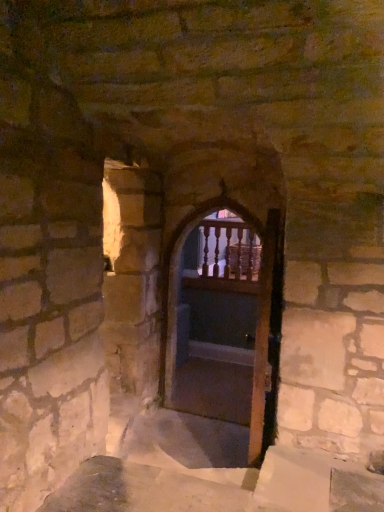
This screenshot has width=384, height=512. Identify the location of wooden screen door at center. (267, 339).

From a real-world perspective, is wooden screen door at center positioned over wooden at center based on gravity?

No, from a real-world perspective, wooden screen door at center is not above wooden at center.

Which of these two, wooden screen door at center or wooden at center, is wider?

wooden at center is wider.

Is wooden screen door at center shorter than wooden at center?

Yes.

Does point (269, 212) lie in front of point (203, 360)?

Yes, it is in front of point (203, 360).

From a real-world perspective, is wooden screen door at center under wooden balusters at center?

Yes, from a real-world perspective, wooden screen door at center is beneath wooden balusters at center.

Is wooden screen door at center far away from wooden balusters at center?

Indeed, wooden screen door at center is not near wooden balusters at center.

Is wooden balusters at center completely or partially inside wooden screen door at center?

No, wooden balusters at center is not a part of wooden screen door at center.

In the scene shown: Can you confirm if wooden balusters at center is thinner than wooden screen door at center?

Yes, wooden balusters at center is thinner than wooden screen door at center.

Between point (261, 250) and point (257, 347), which one is positioned in front?

The point (257, 347) is in front.

From a real-world perspective, which is physically below, wooden balusters at center or wooden screen door at center?

From a 3D spatial view, wooden screen door at center is below.

From the image's perspective, is wooden balusters at center above wooden screen door at center?

Yes, from the image's perspective, wooden balusters at center is on top of wooden screen door at center.

From the picture: Considering the relative sizes of wooden at center and wooden screen door at center in the image provided, is wooden at center shorter than wooden screen door at center?

No.

Are wooden at center and wooden screen door at center far apart?

Absolutely, wooden at center is distant from wooden screen door at center.

From the image's perspective, which one is positioned higher, wooden at center or wooden screen door at center?

From the image's view, wooden at center is above.

From the image's perspective, would you say wooden at center is positioned over wooden balusters at center?

Incorrect, from the image's perspective, wooden at center is lower than wooden balusters at center.

Considering the positions of objects wooden at center and wooden balusters at center in the image provided, who is behind, wooden at center or wooden balusters at center?

Positioned behind is wooden balusters at center.

Locate an element on the screen. balcony on the right of wooden at center is located at coordinates (224, 256).

Would you say wooden at center is outside wooden balusters at center?

wooden at center is positioned outside wooden balusters at center.

From the image's perspective, between wooden balusters at center and wooden at center, which one is located above?

From the image's view, wooden balusters at center is above.

Considering the sizes of objects wooden balusters at center and wooden at center in the image provided, who is thinner, wooden balusters at center or wooden at center?

Thinner between the two is wooden balusters at center.

Which object is more forward, wooden balusters at center or wooden at center?

wooden at center is more forward.

In order to click on door behind the wooden screen door at center in this screenshot , I will do `click(228, 326)`.

Find the location of a particular element. The image size is (384, 512). screen door in front of the wooden balusters at center is located at coordinates (267, 339).

When comparing their distances from wooden balusters at center, does wooden screen door at center or wooden at center seem further?

wooden screen door at center.

Considering their positions, is wooden screen door at center positioned closer to wooden at center than wooden balusters at center?

Among the two, wooden balusters at center is located nearer to wooden at center.

Which object lies nearer to the anchor point wooden screen door at center, wooden at center or wooden balusters at center?

wooden at center is positioned closer to the anchor wooden screen door at center.

In the scene shown: Which object lies further to the anchor point wooden balusters at center, wooden at center or wooden screen door at center?

wooden screen door at center lies further to wooden balusters at center than the other object.

Looking at the image, which one is located closer to wooden screen door at center, wooden balusters at center or wooden at center?

Among the two, wooden at center is located nearer to wooden screen door at center.

Looking at the image, which one is located further to wooden at center, wooden balusters at center or wooden screen door at center?

wooden screen door at center.

This screenshot has width=384, height=512. Identify the location of door located between wooden screen door at center and wooden balusters at center in the depth direction. (228, 326).